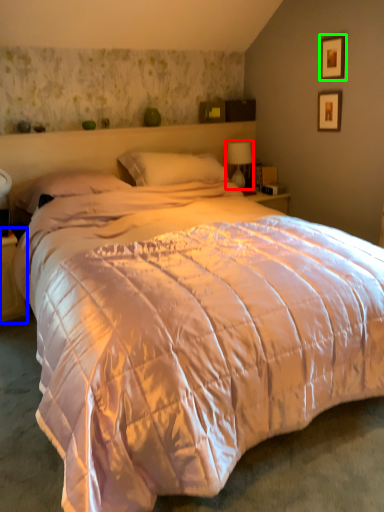
Question: Which object is the farthest from table lamp (highlighted by a red box)? Choose among these: nightstand (highlighted by a blue box) or picture frame (highlighted by a green box).

Choices:
 (A) nightstand
 (B) picture frame

Answer: (A)